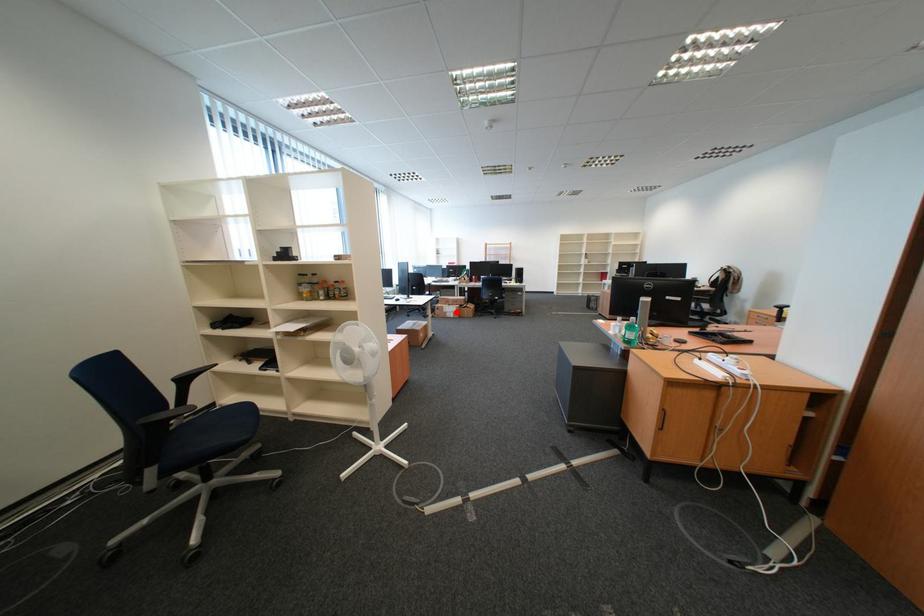
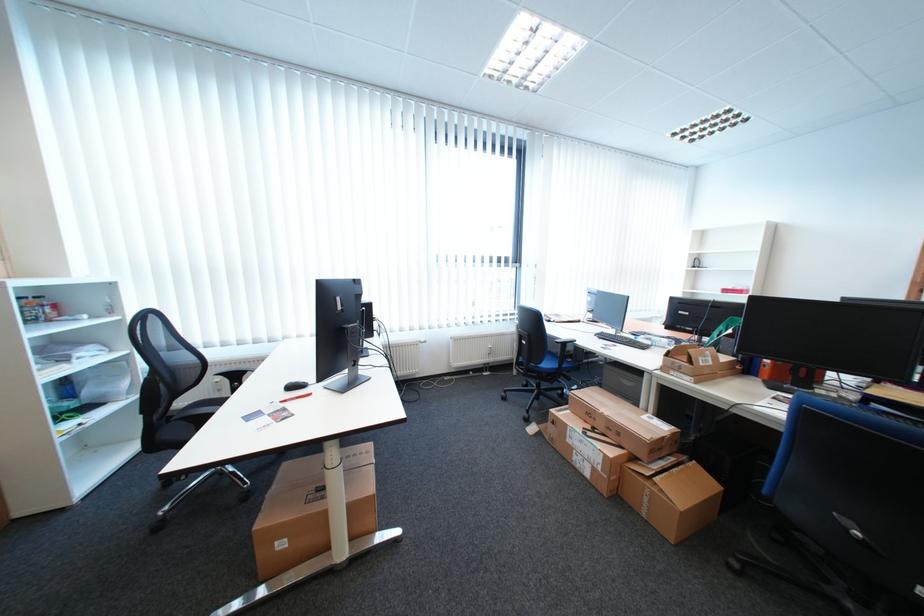
In the second image, find the point that corresponds to the highlighted location in the first image.

(580, 442)